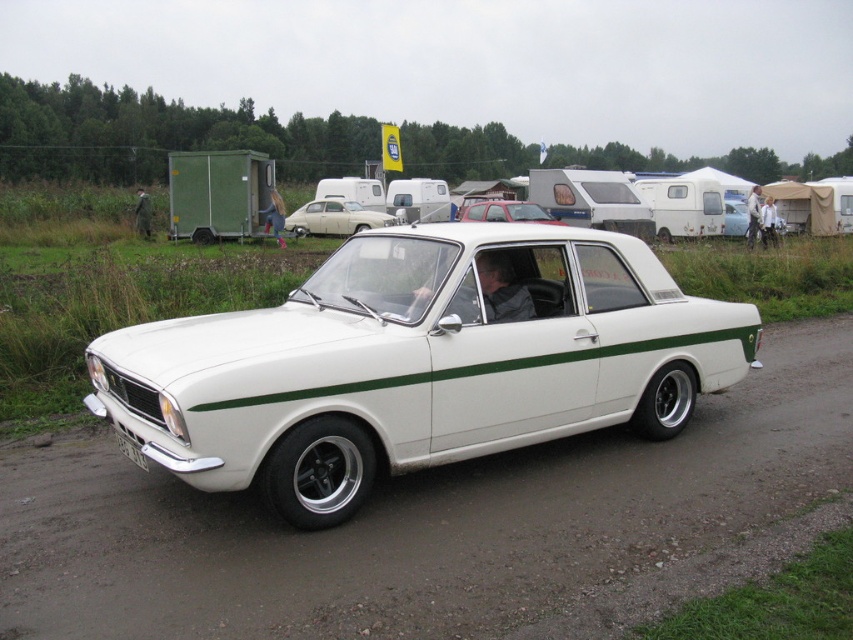
You are standing at the edge of the dirt road and see both the white metallic car at center and the matte white car at center. Which car appears nearer to you?

The white metallic car at center appears nearer to you because it is closer to the viewer than the matte white car at center.

You are a photographer trying to capture a clear photo of the matte red car at center and the white plastic license plate at lower left. Since you want both objects to be in focus, you need to adjust your camera settings based on their sizes. Which object should you focus on first to ensure proper depth of field?

The matte red car at center has a greater height compared to the white plastic license plate at lower left, so you should focus on the matte red car at center first to ensure proper depth of field.

You are driving a small toy car and want to park it between the white smooth dirt track at center and the matte red car at center. Is there enough space between them for the toy car to fit?

The white smooth dirt track at center is positioned on the left side of matte red car at center, so there is space between them for the toy car to fit.